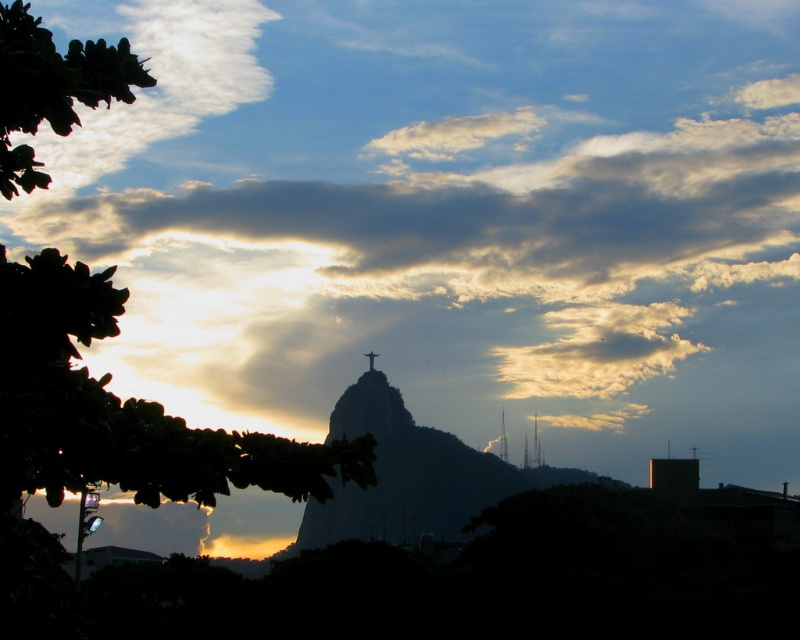
From the picture: You are an architect designing a new observation deck. You need to ensure that the view of the metallic spire at upper center isn not obstructed by the green leafy tree at upper left. Based on the scene description, will the tree block the view of the spire? Explain your reasoning.

The green leafy tree at upper left has a larger width than the metallic spire at upper center. Since the tree is positioned at the upper left and the spire is at the upper center, the wider tree might partially block the view of the spire depending on their exact positions. However, the scene mentions the tree is in the foreground framing the left side, so it may not directly obscure the central spire. Further measurements or angles would be needed for precise obstruction assessment.

You are a photographer trying to capture the sunset with the Christ the Redeemer statue in the frame. You want to position your camera so that the cloudy sky at upper center is exactly at the center of your viewfinder. What coordinate should you aim for?

You should aim for the coordinate point at [492,202] to center the cloudy sky at upper center in your viewfinder.

You are a drone operator planning to capture the sunset with the Christ the Redeemer statue. Your drone has a maximum flight altitude of 600 meters. Based on the scene, can your drone safely fly up to the cloudy sky at upper center without exceeding its altitude limit?

The cloudy sky at upper center is 650.85 meters away from the camera, which exceeds the drone operator maximum flight altitude of 600 meters. Therefore, the drone cannot safely reach the cloudy sky at upper center without exceeding its altitude limit.